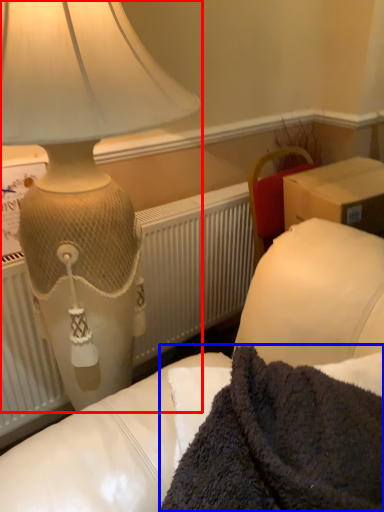
Question: Which point is further to the camera, lamp (highlighted by a red box) or blanket (highlighted by a blue box)?

Choices:
 (A) lamp
 (B) blanket

Answer: (A)